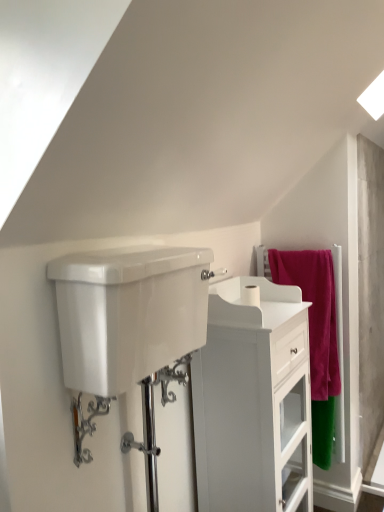
Where is `white glossy cabinet at center`? white glossy cabinet at center is located at coordinates pyautogui.click(x=253, y=401).

This screenshot has width=384, height=512. Describe the element at coordinates (253, 401) in the screenshot. I see `white glossy cabinet at center` at that location.

At what (x,y) coordinates should I click in order to perform the action: click on chrome metallic faucet at lower left. Please return your answer as a coordinate pair (x, y). Image resolution: width=384 pixels, height=512 pixels. Looking at the image, I should click on (86, 424).

Image resolution: width=384 pixels, height=512 pixels. I want to click on pink fabric towel at right, so click(x=318, y=339).

Describe the element at coordinates (154, 423) in the screenshot. I see `polished chrome shower door at center` at that location.

Image resolution: width=384 pixels, height=512 pixels. Find the location of `polished chrome shower door at center`. polished chrome shower door at center is located at coordinates (154, 423).

Locate an element on the screen. The image size is (384, 512). white glossy cabinet at center is located at coordinates (253, 401).

Does white matte toilet paper at center have a greater width compared to polished chrome shower door at center?

No, white matte toilet paper at center is not wider than polished chrome shower door at center.

Is polished chrome shower door at center located within white matte toilet paper at center?

That's incorrect, polished chrome shower door at center is not inside white matte toilet paper at center.

Can you tell me how much white matte toilet paper at center and polished chrome shower door at center differ in facing direction?

They differ by 1.55 degrees in their facing directions.

Does point (377, 238) appear closer or farther from the camera than point (157, 377)?

Point (377, 238) appears to be farther away from the viewer than point (157, 377).

Does concrete screen door at right lie in front of polished chrome shower door at center?

No.

From the picture: Is concrete screen door at right directly adjacent to polished chrome shower door at center?

concrete screen door at right is not next to polished chrome shower door at center, and they're not touching.

From a real-world perspective, is concrete screen door at right positioned under polished chrome shower door at center based on gravity?

No, from a real-world perspective, concrete screen door at right is not beneath polished chrome shower door at center.

Considering the relative positions of pink fabric towel at right and chrome metallic faucet at lower left in the image provided, is pink fabric towel at right to the left of chrome metallic faucet at lower left from the viewer's perspective?

In fact, pink fabric towel at right is to the right of chrome metallic faucet at lower left.

Can you tell me how much pink fabric towel at right and chrome metallic faucet at lower left differ in facing direction?

They differ by 92.1 degrees in their facing directions.

Which is nearer, (321, 326) or (88, 462)?

The point (88, 462) is closer.

Locate an element on the screen. bath towel on the left of concrete screen door at right is located at coordinates (318, 339).

Looking at this image, in the image, is pink fabric towel at right on the left side or the right side of concrete screen door at right?

Clearly, pink fabric towel at right is on the left of concrete screen door at right in the image.

From a real-world perspective, which is physically above, pink fabric towel at right or concrete screen door at right?

concrete screen door at right, from a real-world perspective.

From the image's perspective, which object appears higher, pink fabric towel at right or concrete screen door at right?

concrete screen door at right, from the image's perspective.

From the image's perspective, is concrete screen door at right below white matte toilet paper at center?

Indeed, from the image's perspective, concrete screen door at right is shown beneath white matte toilet paper at center.

Locate an element on the screen. The width and height of the screenshot is (384, 512). toilet paper that is above the concrete screen door at right (from a real-world perspective) is located at coordinates (251, 295).

Which point is more distant from viewer, (376, 277) or (251, 301)?

The point (376, 277) is more distant.

Could you tell me if concrete screen door at right is facing white matte toilet paper at center?

No, concrete screen door at right is not oriented towards white matte toilet paper at center.

Between white glossy tank at center and chrome metallic faucet at lower left, which one has larger size?

white glossy tank at center.

From a real-world perspective, is white glossy tank at center below chrome metallic faucet at lower left?

No.

What are the coordinates of `plumbing fixture below the white glossy tank at center (from the image's perspective)` in the screenshot? It's located at (86, 424).

Who is taller, white glossy tank at center or chrome metallic faucet at lower left?

white glossy tank at center.

From the picture: Choose the correct answer: Is white glossy cabinet at center inside white glossy tank at center or outside it?

white glossy cabinet at center is spatially situated outside white glossy tank at center.

Does white glossy cabinet at center lie in front of white glossy tank at center?

No, it is not.

Based on their sizes in the image, would you say white glossy cabinet at center is bigger or smaller than white glossy tank at center?

Clearly, white glossy cabinet at center is larger in size than white glossy tank at center.

From a real-world perspective, which object rests below the other?

In real-world perspective, white glossy cabinet at center is lower.

This screenshot has height=512, width=384. Identify the location of shower door in front of the white matte toilet paper at center. click(154, 423).

At what (x,y) coordinates should I click in order to perform the action: click on shower door that is on the left side of concrete screen door at right. Please return your answer as a coordinate pair (x, y). Looking at the image, I should click on (154, 423).

When comparing their distances from chrome metallic faucet at lower left, does white matte toilet paper at center or polished chrome shower door at center seem closer?

Based on the image, polished chrome shower door at center appears to be nearer to chrome metallic faucet at lower left.

Based on the photo, when comparing their distances from white matte toilet paper at center, does white glossy tank at center or pink fabric towel at right seem further?

pink fabric towel at right is positioned further to the anchor white matte toilet paper at center.

Which object lies nearer to the anchor point white matte toilet paper at center, polished chrome shower door at center or white glossy tank at center?

polished chrome shower door at center.

When comparing their distances from chrome metallic faucet at lower left, does polished chrome shower door at center or white glossy tank at center seem closer?

Among the two, polished chrome shower door at center is located nearer to chrome metallic faucet at lower left.

Based on their spatial positions, is white glossy cabinet at center or chrome metallic faucet at lower left further from white matte toilet paper at center?

chrome metallic faucet at lower left is positioned further to the anchor white matte toilet paper at center.

Looking at the image, which one is located closer to concrete screen door at right, pink fabric towel at right or white glossy tank at center?

Among the two, pink fabric towel at right is located nearer to concrete screen door at right.

Which object lies nearer to the anchor point concrete screen door at right, polished chrome shower door at center or white glossy tank at center?

Among the two, polished chrome shower door at center is located nearer to concrete screen door at right.

Based on their spatial positions, is pink fabric towel at right or polished chrome shower door at center closer to white glossy tank at center?

polished chrome shower door at center is closer to white glossy tank at center.

This screenshot has width=384, height=512. I want to click on bathroom cabinet located between white glossy tank at center and white matte toilet paper at center in the depth direction, so click(x=253, y=401).

Locate an element on the screen. shower door between chrome metallic faucet at lower left and white matte toilet paper at center along the z-axis is located at coordinates (154, 423).

You are a GUI agent. You are given a task and a screenshot of the screen. Output one action in this format:
    pyautogui.click(x=<x>, y=<y>)
    Task: Click on the shower door between white glossy tank at center and white glossy cabinet at center from top to bottom
    The image size is (384, 512).
    Given the screenshot: What is the action you would take?
    pyautogui.click(x=154, y=423)

The image size is (384, 512). Find the location of `bathroom cabinet between polished chrome shower door at center and pink fabric towel at right from front to back`. bathroom cabinet between polished chrome shower door at center and pink fabric towel at right from front to back is located at coordinates (253, 401).